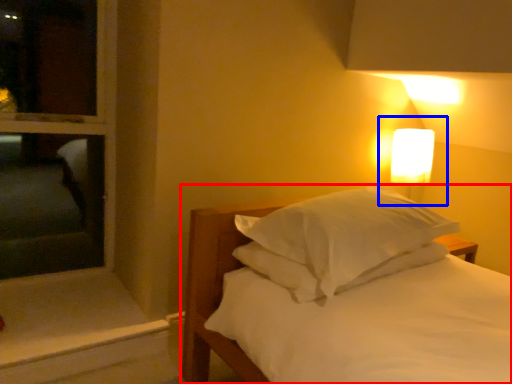
Question: Which point is further to the camera, bed (highlighted by a red box) or bedside lamp (highlighted by a blue box)?

Choices:
 (A) bed
 (B) bedside lamp

Answer: (B)